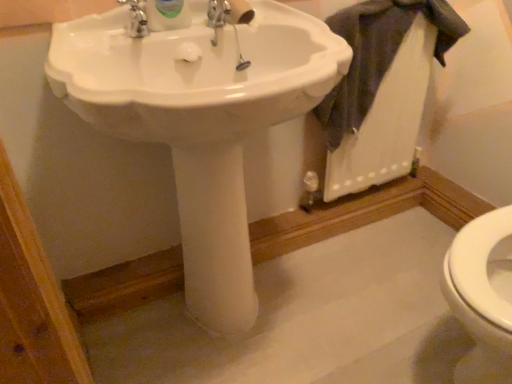
Question: Which is correct: white glossy sink at center is inside dark gray fabric at upper right, or outside of it?

Choices:
 (A) outside
 (B) inside

Answer: (A)

Question: Considering their positions, is white glossy sink at center located in front of or behind dark gray fabric at upper right?

Choices:
 (A) front
 (B) behind

Answer: (A)

Question: Considering the positions of white glossy sink at center and dark gray fabric at upper right in the image, is white glossy sink at center taller or shorter than dark gray fabric at upper right?

Choices:
 (A) short
 (B) tall

Answer: (B)

Question: Does point (406, 4) appear closer or farther from the camera than point (245, 62)?

Choices:
 (A) closer
 (B) farther

Answer: (B)

Question: Would you say dark gray fabric at upper right is to the left or to the right of white glossy sink at center in the picture?

Choices:
 (A) left
 (B) right

Answer: (B)

Question: From a real-world perspective, is dark gray fabric at upper right physically located above or below white glossy sink at center?

Choices:
 (A) below
 (B) above

Answer: (B)

Question: In terms of size, does dark gray fabric at upper right appear bigger or smaller than white glossy sink at center?

Choices:
 (A) small
 (B) big

Answer: (A)